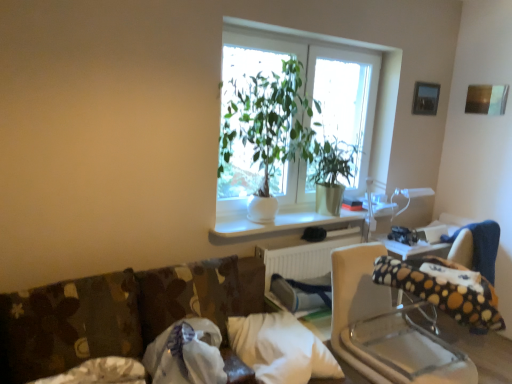
Question: Considering the relative sizes of white soft pillow at lower center, the 3th pillow viewed from the left, and polka dot fabric bean bag chair at right in the image provided, is white soft pillow at lower center, the 3th pillow viewed from the left, taller than polka dot fabric bean bag chair at right?

Choices:
 (A) yes
 (B) no

Answer: (B)

Question: From a real-world perspective, is white soft pillow at lower center, the 3th pillow viewed from the left, physically above polka dot fabric bean bag chair at right?

Choices:
 (A) yes
 (B) no

Answer: (B)

Question: From the image's perspective, is white soft pillow at lower center, the 3th pillow viewed from the left, on top of polka dot fabric bean bag chair at right?

Choices:
 (A) yes
 (B) no

Answer: (B)

Question: Is the depth of white soft pillow at lower center, the 3th pillow viewed from the left, less than that of polka dot fabric bean bag chair at right?

Choices:
 (A) yes
 (B) no

Answer: (B)

Question: Could you tell me if white soft pillow at lower center, which appears as the 1th pillow when viewed from the right, is facing polka dot fabric bean bag chair at right?

Choices:
 (A) yes
 (B) no

Answer: (B)

Question: Is polka dot fabric bean bag chair at right surrounded by white soft pillow at lower center, the 3th pillow viewed from the left?

Choices:
 (A) yes
 (B) no

Answer: (B)

Question: Can you confirm if white soft pillow at lower center, the 3th pillow viewed from the left, is smaller than polka dot fabric rocking chair at center?

Choices:
 (A) yes
 (B) no

Answer: (A)

Question: Is white soft pillow at lower center, which appears as the 1th pillow when viewed from the right, in front of polka dot fabric rocking chair at center?

Choices:
 (A) yes
 (B) no

Answer: (B)

Question: Is white soft pillow at lower center, the 3th pillow viewed from the left, shorter than polka dot fabric rocking chair at center?

Choices:
 (A) yes
 (B) no

Answer: (A)

Question: Is white soft pillow at lower center, the 3th pillow viewed from the left, far away from polka dot fabric rocking chair at center?

Choices:
 (A) no
 (B) yes

Answer: (A)

Question: From a real-world perspective, does white soft pillow at lower center, which appears as the 1th pillow when viewed from the right, stand above polka dot fabric rocking chair at center?

Choices:
 (A) no
 (B) yes

Answer: (A)

Question: Can you confirm if white soft pillow at lower center, the 3th pillow viewed from the left, is positioned to the left of polka dot fabric rocking chair at center?

Choices:
 (A) no
 (B) yes

Answer: (B)

Question: Does polka dot fabric bean bag chair at right lie in front of white soft pillow at lower center, which appears as the 1th pillow when viewed from the right?

Choices:
 (A) no
 (B) yes

Answer: (B)